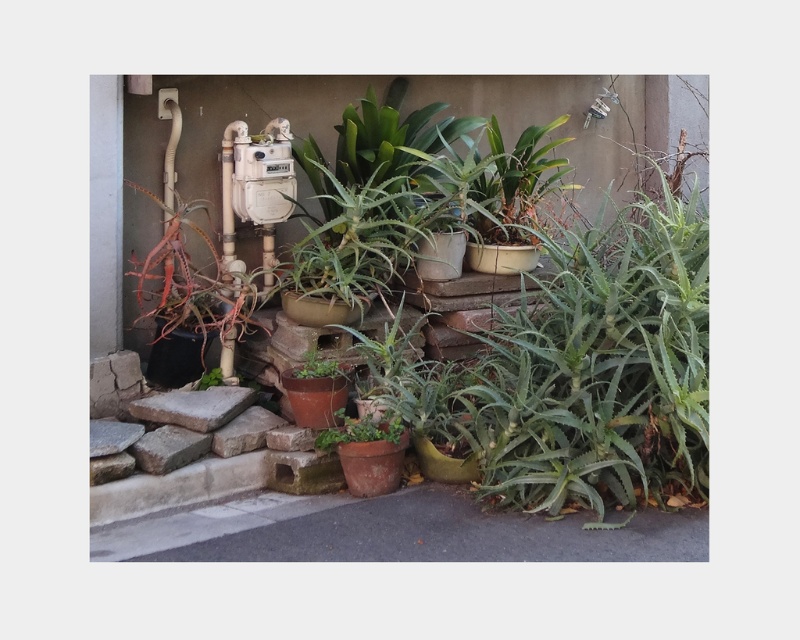
You are standing in the outdoor area and want to water the green matte pot at center. If your watering can has a maximum reach of 4 meters, can you water it without moving closer?

The green matte pot at center is 4.84 meters away from the viewer, which exceeds the watering can reach of 4 meters. You need to move closer to water it.

You are a gardener who needs to water the green matte plant at center. The watering can you have is 30 cm in diameter. Can you place the watering can next to the green matte pot at center without it overlapping the plant?

The green matte pot at center might be wider than the green matte plant at center, so there might be enough space to place the watering can next to the pot without overlapping the plant. However, since the exact width difference isn not specified, it is uncertain.

Consider the image. You are standing in the outdoor area next to the building wall and see two points marked in the scene. Which point is closer to you, point (x=400, y=436) or point (x=336, y=374)?

Point (x=400, y=436) is in front of point (x=336, y=374), so it is closer to you.